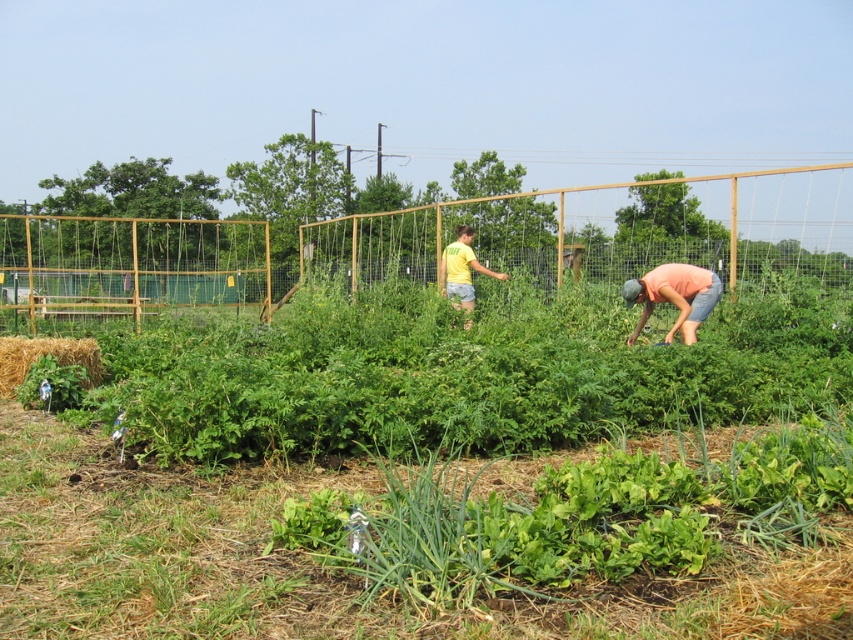
You are a gardener who wants to place a new plant pot between the pink cotton shirt at right and the brown straw bale at lower left. Since the pot is 1.2 meters wide, will it fit between them?

The pink cotton shirt at right is narrower than the brown straw bale at lower left, but the exact distance between them isn

You are standing at the point labeled point (463,324) in the middle ground of the community garden. You want to walk to the entrance gate located at the point labeled point (695,339). Is there a clear path between these two points without needing to go around any obstacles?

Yes, there is a clear path between point (463,324) and point (695,339) because the first point is behind the second point, so you can walk directly towards the entrance gate without obstacles.

You are a visitor at the community garden and see the brown straw bale at lower left and the yellow cotton shirt at center. Which object is located more to the left side of the garden?

The brown straw bale at lower left is more on the left side.